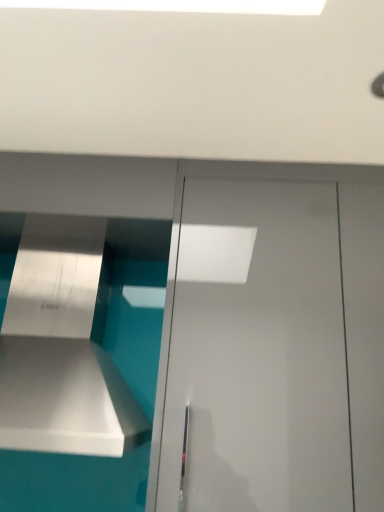
Question: Is white glossy door at center located outside metallic silver vent at left?

Choices:
 (A) yes
 (B) no

Answer: (A)

Question: From a real-world perspective, is white glossy door at center positioned over metallic silver vent at left based on gravity?

Choices:
 (A) no
 (B) yes

Answer: (B)

Question: Is white glossy door at center far from metallic silver vent at left?

Choices:
 (A) no
 (B) yes

Answer: (A)

Question: Can you confirm if white glossy door at center is smaller than metallic silver vent at left?

Choices:
 (A) yes
 (B) no

Answer: (B)

Question: Does white glossy door at center have a greater width compared to metallic silver vent at left?

Choices:
 (A) yes
 (B) no

Answer: (B)

Question: Would you say metallic silver vent at left is part of white glossy door at center's contents?

Choices:
 (A) yes
 (B) no

Answer: (B)

Question: From the image's perspective, does metallic silver vent at left appear lower than white glossy door at center?

Choices:
 (A) yes
 (B) no

Answer: (B)

Question: Considering the relative sizes of metallic silver vent at left and white glossy door at center in the image provided, is metallic silver vent at left bigger than white glossy door at center?

Choices:
 (A) no
 (B) yes

Answer: (A)

Question: Does metallic silver vent at left have a lesser height compared to white glossy door at center?

Choices:
 (A) no
 (B) yes

Answer: (B)

Question: Is metallic silver vent at left not within white glossy door at center?

Choices:
 (A) yes
 (B) no

Answer: (A)

Question: Is the position of metallic silver vent at left less distant than that of white glossy door at center?

Choices:
 (A) yes
 (B) no

Answer: (A)

Question: Can you confirm if metallic silver vent at left is thinner than white glossy door at center?

Choices:
 (A) yes
 (B) no

Answer: (B)

Question: Would you say metallic silver vent at left is inside or outside white glossy door at center?

Choices:
 (A) outside
 (B) inside

Answer: (A)